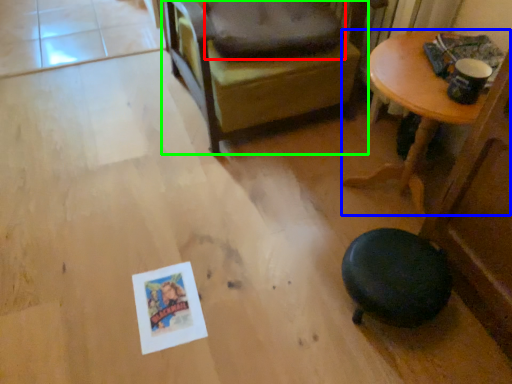
Question: Based on their relative distances, which object is nearer to dog bed (highlighted by a red box)? Choose from table (highlighted by a blue box) and chair (highlighted by a green box).

Choices:
 (A) table
 (B) chair

Answer: (B)